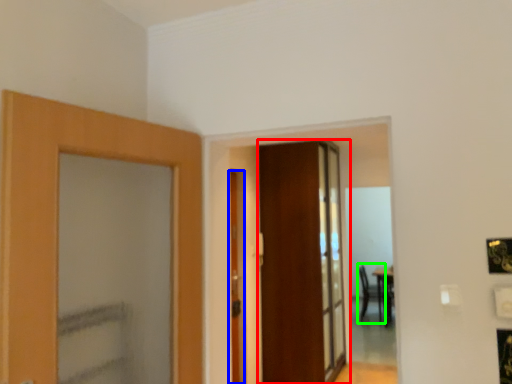
Question: Based on their relative distances, which object is farther from door (highlighted by a red box)? Choose from door (highlighted by a blue box) and armchair (highlighted by a green box).

Choices:
 (A) door
 (B) armchair

Answer: (B)